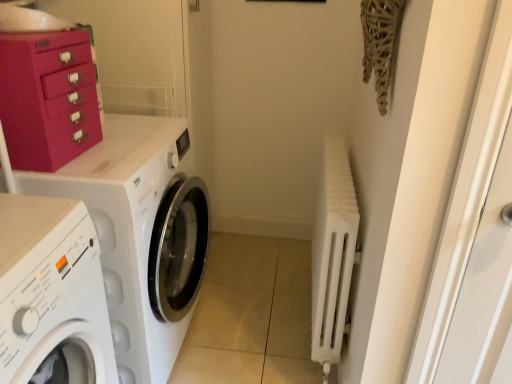
What do you see at coordinates (332, 253) in the screenshot?
I see `white matte radiator at right` at bounding box center [332, 253].

At what (x,y) coordinates should I click in order to perform the action: click on white matte washing machine at left, the 2th washing machine viewed from the back. Please return your answer as a coordinate pair (x, y). This screenshot has height=384, width=512. Looking at the image, I should click on (52, 294).

You are a GUI agent. You are given a task and a screenshot of the screen. Output one action in this format:
    pyautogui.click(x=<x>, y=<y>)
    Task: Click on the white glossy washing machine at left, the 1th washing machine from the back
    This screenshot has width=512, height=384.
    Given the screenshot: What is the action you would take?
    pyautogui.click(x=140, y=234)

Which of these two, white glossy washing machine at left, acting as the 2th washing machine starting from the front, or matte pink cabinet at upper left, stands taller?

Standing taller between the two is white glossy washing machine at left, acting as the 2th washing machine starting from the front.

From the image's perspective, is white glossy washing machine at left, acting as the 2th washing machine starting from the front, above or below matte pink cabinet at upper left?

From the image's perspective, white glossy washing machine at left, acting as the 2th washing machine starting from the front, appears below matte pink cabinet at upper left.

Is the surface of white glossy washing machine at left, the 1th washing machine from the back, in direct contact with matte pink cabinet at upper left?

No, white glossy washing machine at left, the 1th washing machine from the back, is not beside matte pink cabinet at upper left.

Is white glossy washing machine at left, the 1th washing machine from the back, in front of or behind matte pink cabinet at upper left in the image?

Clearly, white glossy washing machine at left, the 1th washing machine from the back, is behind matte pink cabinet at upper left.

Between matte pink cabinet at upper left and white matte washing machine at left, which is the 1th washing machine in front-to-back order, which one has larger size?

white matte washing machine at left, which is the 1th washing machine in front-to-back order.

From the image's perspective, between matte pink cabinet at upper left and white matte washing machine at left, which is the 1th washing machine in front-to-back order, who is located below?

white matte washing machine at left, which is the 1th washing machine in front-to-back order, appears lower in the image.

From their relative heights in the image, would you say matte pink cabinet at upper left is taller or shorter than white matte washing machine at left, the 2th washing machine viewed from the back?

Clearly, matte pink cabinet at upper left is shorter compared to white matte washing machine at left, the 2th washing machine viewed from the back.

How much distance is there between matte pink cabinet at upper left and white matte washing machine at left, which is the 1th washing machine in front-to-back order?

matte pink cabinet at upper left and white matte washing machine at left, which is the 1th washing machine in front-to-back order, are 13.36 inches apart.

Is white matte radiator at right looking in the opposite direction of matte pink cabinet at upper left?

No, white matte radiator at right is not facing the opposite direction of matte pink cabinet at upper left.

Considering the sizes of objects white matte radiator at right and matte pink cabinet at upper left in the image provided, who is thinner, white matte radiator at right or matte pink cabinet at upper left?

With smaller width is white matte radiator at right.

Between white matte radiator at right and matte pink cabinet at upper left, which one appears on the left side from the viewer's perspective?

Positioned to the left is matte pink cabinet at upper left.

Which point is more distant from viewer, (345, 149) or (70, 113)?

The point (345, 149) is farther.

Is white glossy washing machine at left, the 1th washing machine from the back, surrounded by white matte washing machine at left, which is the 1th washing machine in front-to-back order?

No, white glossy washing machine at left, the 1th washing machine from the back, is located outside of white matte washing machine at left, which is the 1th washing machine in front-to-back order.

In the scene shown: From a real-world perspective, does white matte washing machine at left, the 2th washing machine viewed from the back, stand above white glossy washing machine at left, acting as the 2th washing machine starting from the front?

Yes, from a real-world perspective, white matte washing machine at left, the 2th washing machine viewed from the back, is over white glossy washing machine at left, acting as the 2th washing machine starting from the front

Does white matte washing machine at left, the 2th washing machine viewed from the back, have a greater width compared to white glossy washing machine at left, acting as the 2th washing machine starting from the front?

No.

Can you confirm if white matte washing machine at left, which is the 1th washing machine in front-to-back order, is shorter than white glossy washing machine at left, the 1th washing machine from the back?

Yes, white matte washing machine at left, which is the 1th washing machine in front-to-back order, is shorter than white glossy washing machine at left, the 1th washing machine from the back.

Is point (22, 246) farther from camera compared to point (334, 358)?

No, it is not.

The image size is (512, 384). Identify the location of the 2nd washing machine counting from the left of the white matte radiator at right. (52, 294).

Does white matte washing machine at left, which is the 1th washing machine in front-to-back order, appear on the right side of white matte radiator at right?

Incorrect, white matte washing machine at left, which is the 1th washing machine in front-to-back order, is not on the right side of white matte radiator at right.

Is white matte washing machine at left, which is the 1th washing machine in front-to-back order, taller than white matte radiator at right?

Incorrect, the height of white matte washing machine at left, which is the 1th washing machine in front-to-back order, is not larger of that of white matte radiator at right.

Is white glossy washing machine at left, acting as the 2th washing machine starting from the front, looking in the opposite direction of white matte radiator at right?

No.

Does point (123, 217) lie in front of point (333, 293)?

Yes, point (123, 217) is in front of point (333, 293).

Between white glossy washing machine at left, the 1th washing machine from the back, and white matte radiator at right, which one has smaller width?

Thinner between the two is white matte radiator at right.

Identify the location of washing machine that is the 1st object located in front of the white matte radiator at right. The height and width of the screenshot is (384, 512). (140, 234).

From the image's perspective, is white glossy washing machine at left, the 1th washing machine from the back, located beneath white matte washing machine at left, which is the 1th washing machine in front-to-back order?

Actually, white glossy washing machine at left, the 1th washing machine from the back, appears above white matte washing machine at left, which is the 1th washing machine in front-to-back order, in the image.

Which point is more distant from viewer, (164, 131) or (6, 285)?

The point (164, 131) is farther from the camera.

Which is more to the right, white glossy washing machine at left, the 1th washing machine from the back, or white matte washing machine at left, which is the 1th washing machine in front-to-back order?

white glossy washing machine at left, the 1th washing machine from the back, is more to the right.

Where is `washing machine on the right of white matte washing machine at left, which is the 1th washing machine in front-to-back order`? The height and width of the screenshot is (384, 512). washing machine on the right of white matte washing machine at left, which is the 1th washing machine in front-to-back order is located at coordinates (140, 234).

Locate an element on the screen. This screenshot has width=512, height=384. the 2nd washing machine positioned below the matte pink cabinet at upper left (from a real-world perspective) is located at coordinates (140, 234).

Find the location of `cabinetry behind the white matte washing machine at left, the 2th washing machine viewed from the back`. cabinetry behind the white matte washing machine at left, the 2th washing machine viewed from the back is located at coordinates (48, 98).

Estimate the real-world distances between objects in this image. Which object is closer to white glossy washing machine at left, acting as the 2th washing machine starting from the front, white matte radiator at right or white matte washing machine at left, the 2th washing machine viewed from the back?

Among the two, white matte washing machine at left, the 2th washing machine viewed from the back, is located nearer to white glossy washing machine at left, acting as the 2th washing machine starting from the front.

Considering their positions, is white matte radiator at right positioned closer to white matte washing machine at left, which is the 1th washing machine in front-to-back order, than white glossy washing machine at left, the 1th washing machine from the back?

white glossy washing machine at left, the 1th washing machine from the back, is positioned closer to the anchor white matte washing machine at left, which is the 1th washing machine in front-to-back order.

Based on their spatial positions, is white matte washing machine at left, which is the 1th washing machine in front-to-back order, or white matte radiator at right further from white glossy washing machine at left, the 1th washing machine from the back?

Answer: white matte radiator at right.

Considering their positions, is white matte washing machine at left, the 2th washing machine viewed from the back, positioned further to matte pink cabinet at upper left than white glossy washing machine at left, the 1th washing machine from the back?

white matte washing machine at left, the 2th washing machine viewed from the back, is further to matte pink cabinet at upper left.

From the image, which object appears to be farther from matte pink cabinet at upper left, white glossy washing machine at left, the 1th washing machine from the back, or white matte washing machine at left, the 2th washing machine viewed from the back?

white matte washing machine at left, the 2th washing machine viewed from the back, is further to matte pink cabinet at upper left.

When comparing their distances from matte pink cabinet at upper left, does white matte washing machine at left, which is the 1th washing machine in front-to-back order, or white matte radiator at right seem further?

Among the two, white matte radiator at right is located further to matte pink cabinet at upper left.

When comparing their distances from matte pink cabinet at upper left, does white matte radiator at right or white matte washing machine at left, which is the 1th washing machine in front-to-back order, seem further?

Among the two, white matte radiator at right is located further to matte pink cabinet at upper left.

From the image, which object appears to be farther from white matte radiator at right, matte pink cabinet at upper left or white matte washing machine at left, which is the 1th washing machine in front-to-back order?

matte pink cabinet at upper left is positioned further to the anchor white matte radiator at right.

The height and width of the screenshot is (384, 512). What are the coordinates of `washing machine between white matte washing machine at left, the 2th washing machine viewed from the back, and white matte radiator at right, in the horizontal direction` in the screenshot? It's located at (140, 234).

Locate an element on the screen. The width and height of the screenshot is (512, 384). washing machine between matte pink cabinet at upper left and white matte washing machine at left, the 2th washing machine viewed from the back, vertically is located at coordinates (140, 234).